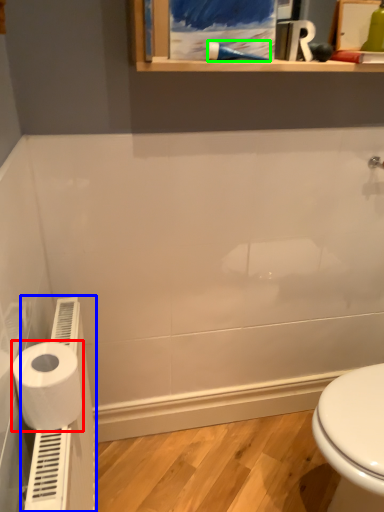
Question: Based on their relative distances, which object is nearer to toilet paper (highlighted by a red box)? Choose from water heater (highlighted by a blue box) and shower (highlighted by a green box).

Choices:
 (A) water heater
 (B) shower

Answer: (A)